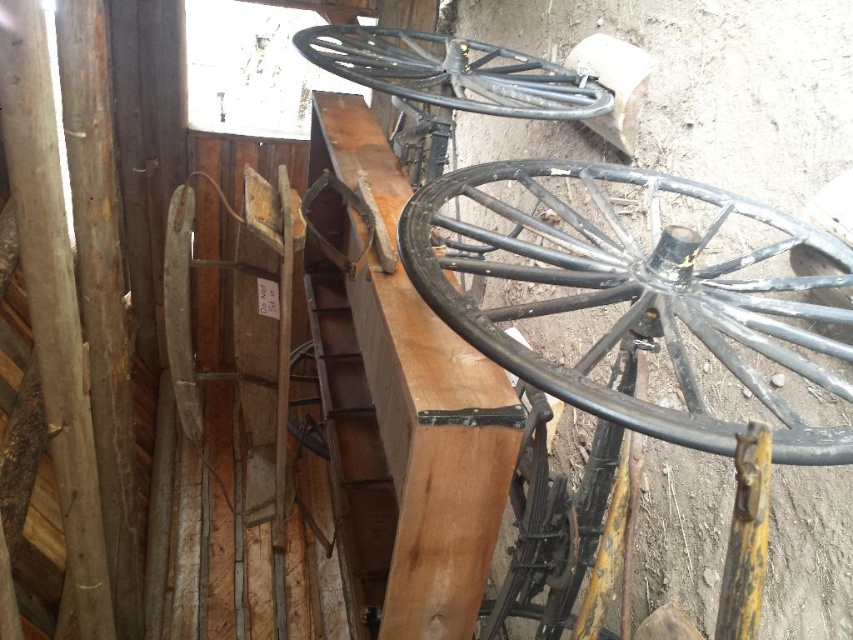
Question: Estimate the real-world distances between objects in this image. Which object is closer to the brown wooden plank at center?

Choices:
 (A) black metal/wire wheel at center
 (B) black metal/wrought iron wagon wheel at upper center
 (C) black metal/wrought iron wagon wheel at center
 (D) black metal/wrought iron wheel at center

Answer: (B)

Question: Can you confirm if brown wooden plank at center is smaller than black metal/wire wheel at center?

Choices:
 (A) no
 (B) yes

Answer: (A)

Question: Can you confirm if brown wooden plank at center is wider than black metal/wrought iron wheel at center?

Choices:
 (A) no
 (B) yes

Answer: (B)

Question: Which point is closer to the camera?

Choices:
 (A) (451, 61)
 (B) (840, 452)
 (C) (532, 420)
 (D) (289, 419)

Answer: (B)

Question: Which object is closer to the camera taking this photo?

Choices:
 (A) black metal/wire wheel at center
 (B) black metal/wrought iron wagon wheel at center

Answer: (B)

Question: Is black metal/wrought iron wagon wheel at center to the left of black metal/wire wheel at center from the viewer's perspective?

Choices:
 (A) no
 (B) yes

Answer: (A)